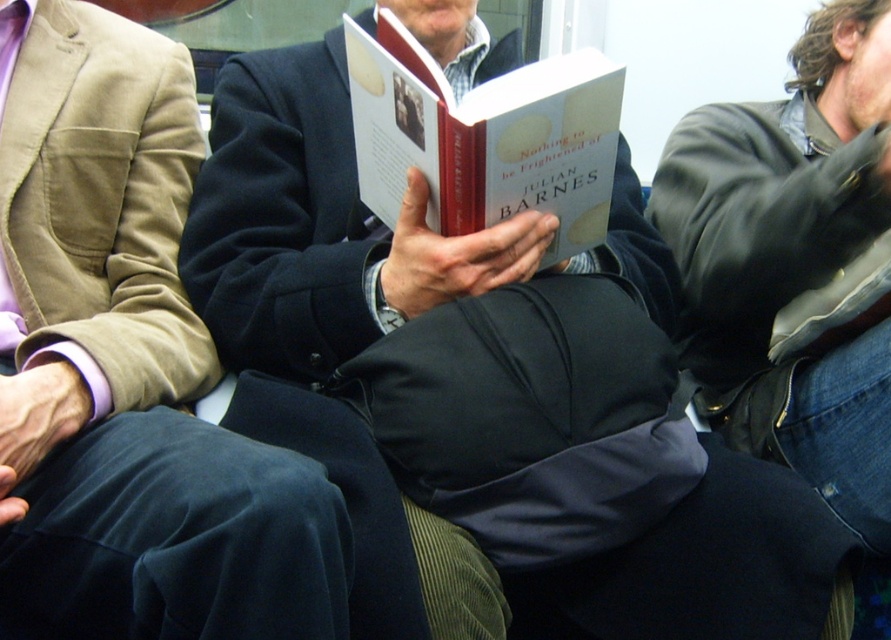
How distant is matte black jacket at center from hardcover book at center?

matte black jacket at center is 15.31 inches away from hardcover book at center.

Which is in front, point (48, 611) or point (554, 172)?

Point (48, 611)

Between point (185, 540) and point (382, 32), which one is positioned in front?

Point (185, 540)

I want to click on matte black jacket at center, so click(x=129, y=365).

Based on the photo, who is lower down, leather jacket at right or hardcover book at center?

Positioned lower is leather jacket at right.

Who is positioned more to the left, leather jacket at right or hardcover book at center?

From the viewer's perspective, hardcover book at center appears more on the left side.

This screenshot has width=891, height=640. What do you see at coordinates (795, 260) in the screenshot?
I see `leather jacket at right` at bounding box center [795, 260].

I want to click on leather jacket at right, so click(795, 260).

Between matte black jacket at center and leather jacket at right, which one is positioned higher?

leather jacket at right is higher up.

Can you confirm if matte black jacket at center is positioned below leather jacket at right?

Yes, matte black jacket at center is below leather jacket at right.

Which is in front, point (105, 636) or point (846, 154)?

Positioned in front is point (105, 636).

You are a GUI agent. You are given a task and a screenshot of the screen. Output one action in this format:
    pyautogui.click(x=<x>, y=<y>)
    Task: Click on the matte black jacket at center
    
    Given the screenshot: What is the action you would take?
    pyautogui.click(x=129, y=365)